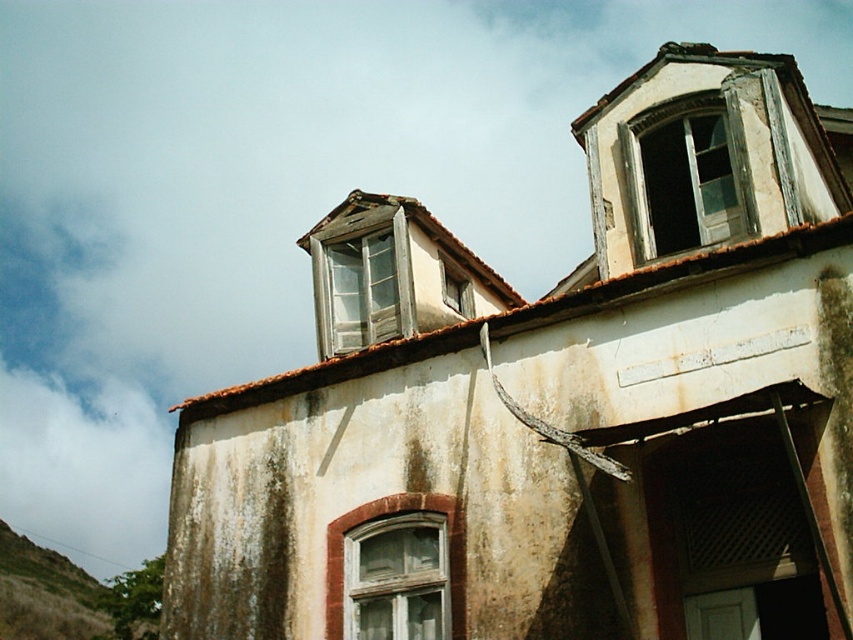
You are standing 5 meters away from the building and want to reach both the transparent glass window at center and the wooden window at center. Which window will you reach first if you walk directly toward the building?

Both windows are at the same location at the center of the building, so you will reach them at the same time.

You are an architect assessing the building facade. You need to install a new air conditioning unit that requires a 2.5 meter wide space. Which window between the transparent glass window at center and the matte glass window at upper center would you choose to place it next to, based on their widths?

The transparent glass window at center might be wider than matte glass window at upper center, so you should choose the transparent glass window at center to place the air conditioning unit next to as it likely provides the required 2.5 meter width.

You are an architect examining the building. You notice both a transparent glass window at center and a wooden window at center. Which one has a larger width?

The transparent glass window at center is wider than the wooden window at center according to the description.